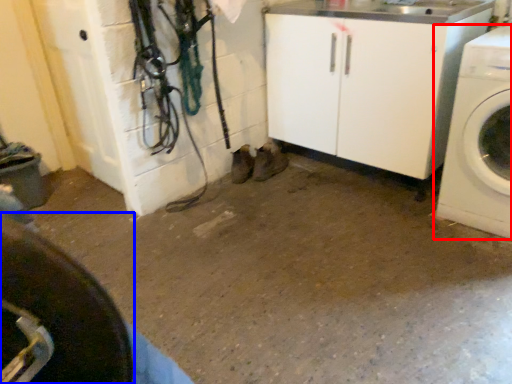
Question: Which point is closer to the camera, washing machine (highlighted by a red box) or tire (highlighted by a blue box)?

Choices:
 (A) washing machine
 (B) tire

Answer: (B)